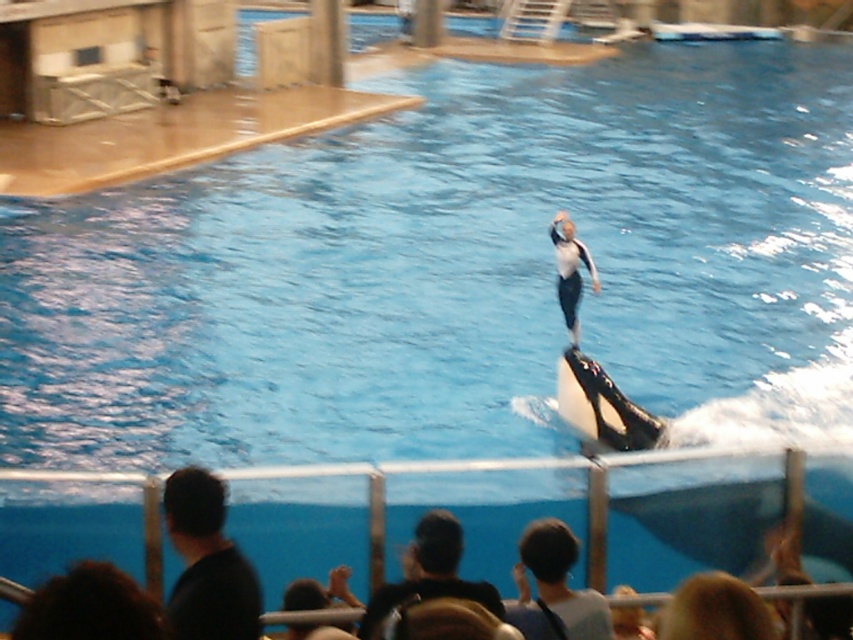
Question: Among these objects, which one is nearest to the camera?

Choices:
 (A) brown hair at lower left
 (B) white matte wetsuit at center
 (C) black matte wetsuit at lower left
 (D) blonde hair at lower right

Answer: (A)

Question: Where is dark blue hair at lower center located in relation to blonde hair at lower right in the image?

Choices:
 (A) below
 (B) above

Answer: (B)

Question: Which of the following is the farthest from the observer?

Choices:
 (A) brown hair at lower left
 (B) white fabric shirt at lower center
 (C) black matte wetsuit at lower left

Answer: (B)

Question: Can you confirm if black and white whale at center is smaller than white matte wetsuit at center?

Choices:
 (A) no
 (B) yes

Answer: (A)

Question: From the image, what is the correct spatial relationship of black matte wetsuit at lower left in relation to white matte wetsuit at center?

Choices:
 (A) left
 (B) right

Answer: (A)

Question: Which point is farther to the camera?

Choices:
 (A) blonde hair at lower right
 (B) brown hair at lower left
 (C) black and white whale at center

Answer: (C)